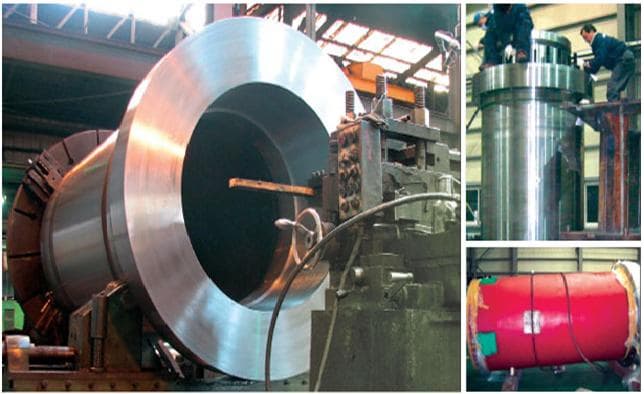
The image size is (644, 394). What are the coordinates of `cords` in the screenshot? It's located at (422, 194), (473, 114), (567, 301).